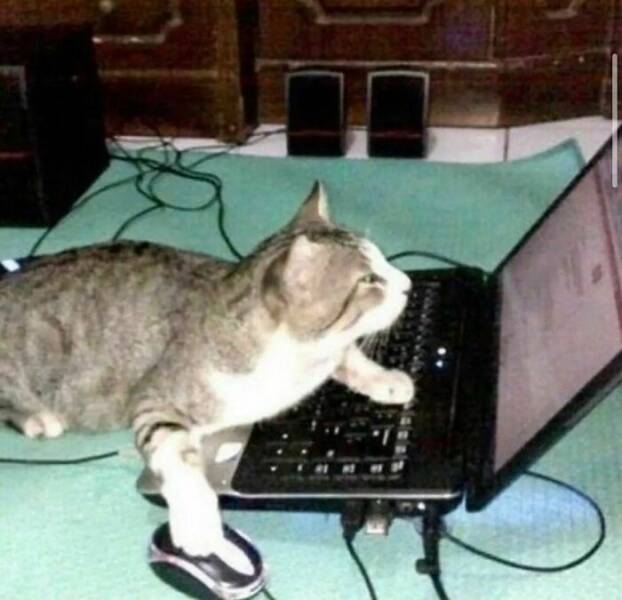
Locate an element on the screen. The image size is (622, 600). usb wire is located at coordinates (348, 518).